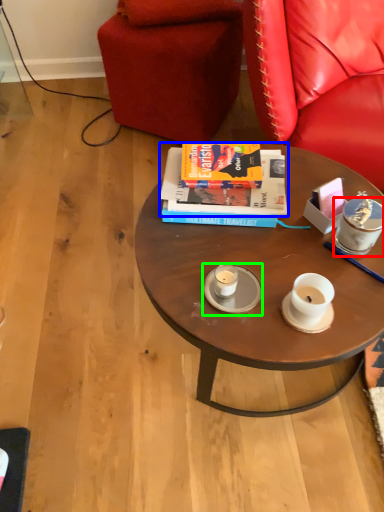
Question: Which object is the farthest from coffee cup (highlighted by a red box)? Choose among these: book (highlighted by a blue box) or saucer (highlighted by a green box).

Choices:
 (A) book
 (B) saucer

Answer: (B)